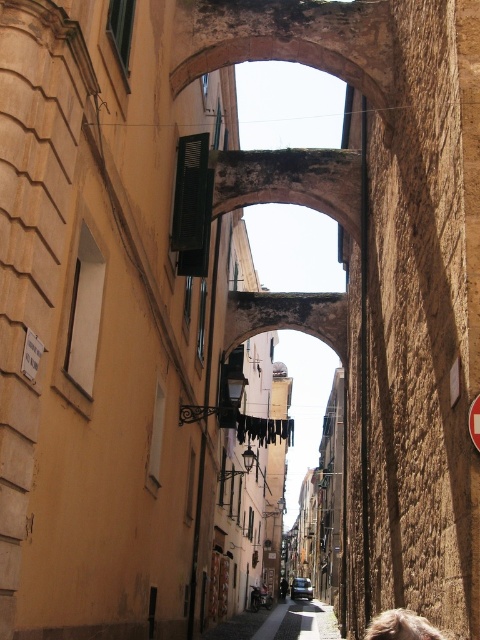
Who is positioned more to the right, smooth stone alley at center or blonde hair at lower right?

From the viewer's perspective, smooth stone alley at center appears more on the right side.

Is point (324, 637) closer to camera compared to point (421, 620)?

That is False.

Is point (328, 628) positioned before point (388, 618)?

No, (328, 628) is further to viewer.

Where is `smooth stone alley at center`? The width and height of the screenshot is (480, 640). smooth stone alley at center is located at coordinates (280, 624).

Can you confirm if blonde hair at lower right is positioned to the right of black fabric laundry at center?

Correct, you'll find blonde hair at lower right to the right of black fabric laundry at center.

Where is `blonde hair at lower right`? The height and width of the screenshot is (640, 480). blonde hair at lower right is located at coordinates (400, 627).

In order to click on blonde hair at lower right in this screenshot , I will do `click(400, 627)`.

Can you confirm if smooth stone alley at center is positioned to the left of black fabric laundry at center?

No, smooth stone alley at center is not to the left of black fabric laundry at center.

Who is taller, smooth stone alley at center or black fabric laundry at center?

With more height is smooth stone alley at center.

Where is `smooth stone alley at center`? smooth stone alley at center is located at coordinates (280, 624).